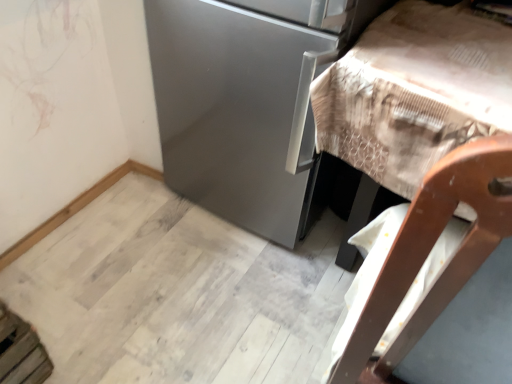
The width and height of the screenshot is (512, 384). What do you see at coordinates (413, 95) in the screenshot? I see `wooden chair at right` at bounding box center [413, 95].

The height and width of the screenshot is (384, 512). I want to click on wooden chair at right, so click(413, 95).

You are a GUI agent. You are given a task and a screenshot of the screen. Output one action in this format:
    pyautogui.click(x=<x>, y=<y>)
    Task: Click on the satin silver refrigerator at center
    Image resolution: width=512 pixels, height=384 pixels.
    Given the screenshot: What is the action you would take?
    pyautogui.click(x=248, y=103)

The height and width of the screenshot is (384, 512). Describe the element at coordinates (248, 103) in the screenshot. I see `satin silver refrigerator at center` at that location.

This screenshot has width=512, height=384. I want to click on wooden chair at right, so click(413, 95).

Is satin silver refrigerator at center to the right of wooden chair at right from the viewer's perspective?

No.

Considering the positions of objects satin silver refrigerator at center and wooden chair at right in the image provided, who is in front, satin silver refrigerator at center or wooden chair at right?

wooden chair at right is in front.

Which is closer, (244, 93) or (382, 22)?

Point (244, 93) appears to be farther away from the viewer than point (382, 22).

From the image's perspective, is satin silver refrigerator at center positioned above or below wooden chair at right?

satin silver refrigerator at center is above wooden chair at right.

From a real-world perspective, which object rests below the other?

satin silver refrigerator at center.

Between satin silver refrigerator at center and wooden chair at right, which one has larger width?

wooden chair at right.

Who is shorter, satin silver refrigerator at center or wooden chair at right?

wooden chair at right is shorter.

Which of these two, satin silver refrigerator at center or wooden chair at right, is smaller?

wooden chair at right is smaller.

Can we say satin silver refrigerator at center lies outside wooden chair at right?

Absolutely, satin silver refrigerator at center is external to wooden chair at right.

Is there a large distance between satin silver refrigerator at center and wooden chair at right?

That's not correct — satin silver refrigerator at center is a little close to wooden chair at right.

Could you tell me if satin silver refrigerator at center is facing wooden chair at right?

No, satin silver refrigerator at center is not aimed at wooden chair at right.

The width and height of the screenshot is (512, 384). What are the coordinates of `appliance below the wooden chair at right (from a real-world perspective)` in the screenshot? It's located at (248, 103).

Looking at this image, would you say wooden chair at right is to the left or to the right of satin silver refrigerator at center in the picture?

In the image, wooden chair at right appears on the right side of satin silver refrigerator at center.

In the scene shown: Is wooden chair at right further to camera compared to satin silver refrigerator at center?

No, it is in front of satin silver refrigerator at center.

Considering the positions of point (421, 19) and point (257, 178), is point (421, 19) closer or farther from the camera than point (257, 178)?

Point (421, 19) is closer to the camera than point (257, 178).

From the image's perspective, does wooden chair at right appear higher than satin silver refrigerator at center?

Actually, wooden chair at right appears below satin silver refrigerator at center in the image.

From a real-world perspective, is wooden chair at right on satin silver refrigerator at center?

Indeed, from a real-world perspective, wooden chair at right stands above satin silver refrigerator at center.

Between wooden chair at right and satin silver refrigerator at center, which one has larger width?

wooden chair at right is wider.

In the scene shown: In terms of height, does wooden chair at right look taller or shorter compared to satin silver refrigerator at center?

Clearly, wooden chair at right is shorter compared to satin silver refrigerator at center.

Can you confirm if wooden chair at right is bigger than satin silver refrigerator at center?

Actually, wooden chair at right might be smaller than satin silver refrigerator at center.

Consider the image. Is wooden chair at right not inside satin silver refrigerator at center?

Yes.

Are wooden chair at right and satin silver refrigerator at center beside each other?

No, wooden chair at right is not making contact with satin silver refrigerator at center.

Is wooden chair at right facing away from satin silver refrigerator at center?

No, wooden chair at right is not facing away from satin silver refrigerator at center.

How many degrees apart are the facing directions of wooden chair at right and satin silver refrigerator at center?

wooden chair at right and satin silver refrigerator at center are facing 0.723 degrees away from each other.

The image size is (512, 384). I want to click on furniture above the satin silver refrigerator at center (from a real-world perspective), so click(x=413, y=95).

The height and width of the screenshot is (384, 512). Find the location of `furniture located above the satin silver refrigerator at center (from a real-world perspective)`. furniture located above the satin silver refrigerator at center (from a real-world perspective) is located at coordinates (413, 95).

I want to click on appliance located underneath the wooden chair at right (from a real-world perspective), so click(x=248, y=103).